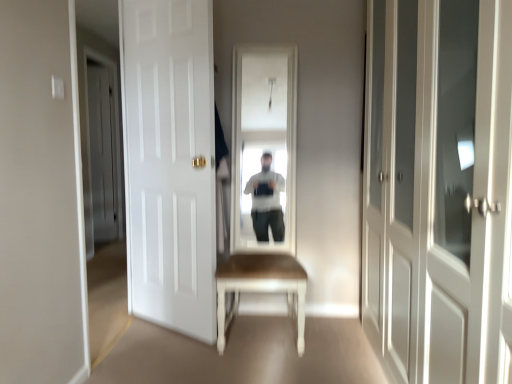
Question: Does white matte door at left, placed as the 3th door when sorted from front to back, come behind white matte door at center, which is counted as the 2th door, starting from the left?

Choices:
 (A) yes
 (B) no

Answer: (A)

Question: Is white matte door at left, which appears as the first door when viewed from the left, surrounding white matte door at center, which is counted as the 2th door, starting from the back?

Choices:
 (A) yes
 (B) no

Answer: (B)

Question: Considering the relative positions of white matte door at left, placed as the 3th door when sorted from front to back, and white matte door at center, the second door viewed from the front, in the image provided, is white matte door at left, placed as the 3th door when sorted from front to back, in front of white matte door at center, the second door viewed from the front,?

Choices:
 (A) no
 (B) yes

Answer: (A)

Question: From a real-world perspective, is white matte door at left, acting as the 3th door starting from the right, physically below white matte door at center, which is counted as the 2th door, starting from the left?

Choices:
 (A) yes
 (B) no

Answer: (B)

Question: From a real-world perspective, is white matte door at left, which is counted as the first door, starting from the back, positioned over white matte door at center, which appears as the second door when viewed from the right, based on gravity?

Choices:
 (A) yes
 (B) no

Answer: (A)

Question: From a real-world perspective, is white glossy cabinet at right, which is the 3th door from left to right, above or below white matte door at center, which is counted as the 2th door, starting from the left?

Choices:
 (A) below
 (B) above

Answer: (A)

Question: Based on their positions, is white glossy cabinet at right, acting as the 1th door starting from the front, located to the left or right of white matte door at center, which is counted as the 2th door, starting from the back?

Choices:
 (A) right
 (B) left

Answer: (A)

Question: From their relative heights in the image, would you say white glossy cabinet at right, placed as the first door when sorted from right to left, is taller or shorter than white matte door at center, the second door viewed from the front?

Choices:
 (A) short
 (B) tall

Answer: (A)

Question: Looking at their shapes, would you say white glossy cabinet at right, placed as the first door when sorted from right to left, is wider or thinner than white matte door at center, which is counted as the 2th door, starting from the back?

Choices:
 (A) wide
 (B) thin

Answer: (A)

Question: In terms of width, does white matte door at left, which is counted as the first door, starting from the back, look wider or thinner when compared to white glossy cabinet at right, the 3th door from the back?

Choices:
 (A) thin
 (B) wide

Answer: (A)

Question: In the image, is white matte door at left, which appears as the first door when viewed from the left, positioned in front of or behind white glossy cabinet at right, which is the 3th door from left to right?

Choices:
 (A) front
 (B) behind

Answer: (B)

Question: Considering the positions of white matte door at left, which appears as the first door when viewed from the left, and white glossy cabinet at right, placed as the first door when sorted from right to left, in the image, is white matte door at left, which appears as the first door when viewed from the left, bigger or smaller than white glossy cabinet at right, placed as the first door when sorted from right to left,?

Choices:
 (A) small
 (B) big

Answer: (A)

Question: Would you say white matte door at left, acting as the 3th door starting from the right, is to the left or to the right of white glossy cabinet at right, placed as the first door when sorted from right to left, in the picture?

Choices:
 (A) left
 (B) right

Answer: (A)

Question: From a real-world perspective, is light brown wooden table at center positioned above or below white matte door at left, which is counted as the first door, starting from the back?

Choices:
 (A) below
 (B) above

Answer: (A)

Question: Considering the positions of light brown wooden table at center and white matte door at left, placed as the 3th door when sorted from front to back, in the image, is light brown wooden table at center taller or shorter than white matte door at left, placed as the 3th door when sorted from front to back,?

Choices:
 (A) tall
 (B) short

Answer: (B)